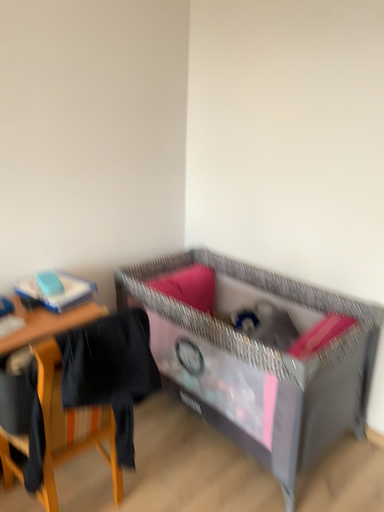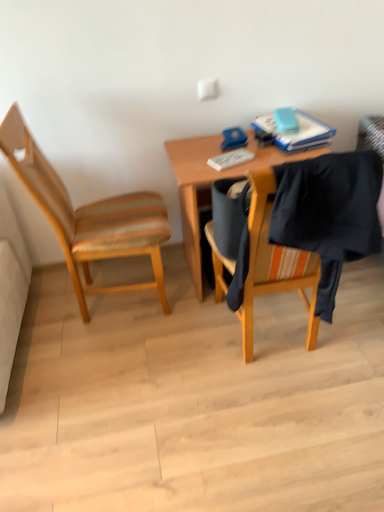
Question: Which way did the camera rotate in the video?

Choices:
 (A) rotated right
 (B) rotated left

Answer: (B)